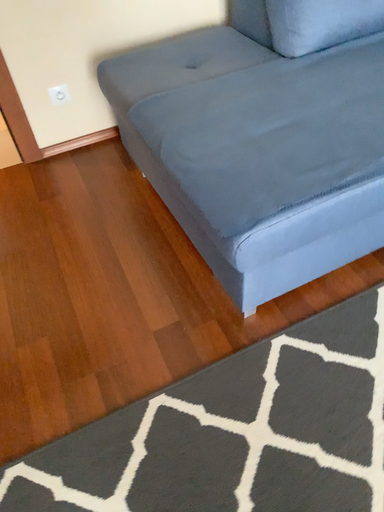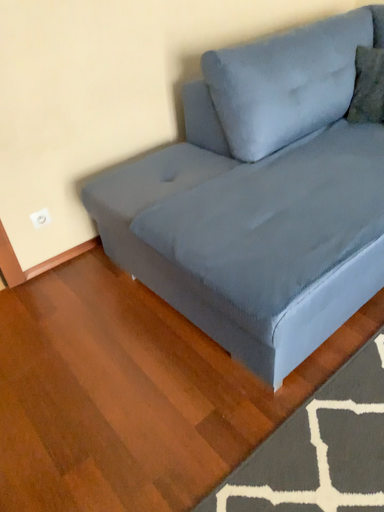
Question: Which way did the camera rotate in the video?

Choices:
 (A) rotated upward
 (B) rotated downward

Answer: (A)